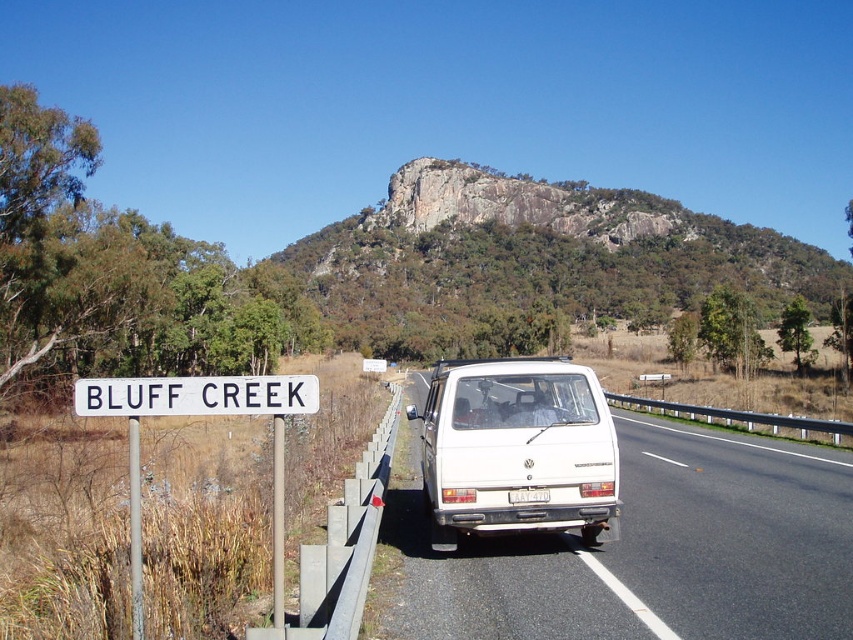
You are standing at the camera position and want to walk to the white plastic van at center. Which direction should you walk to reach it?

Since the white plastic van at center is located at point (648, 550) in 2D coordinates, you should walk towards the center of the image to reach it.

You are a delivery driver who needs to park your van on the road shown in the image. There are two vans present, a white plastic van at center and a white matte van at center. Which van is positioned lower on the road where you can easily access the parking spot?

The white plastic van at center is located below the white matte van at center, so it is positioned lower on the road and easier to access for parking.